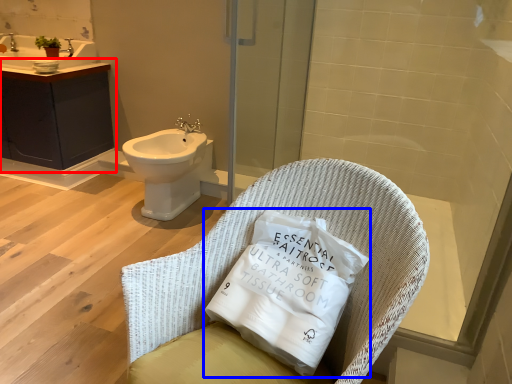
Question: Which of the following is the closest to the observer, bathroom cabinet (highlighted by a red box) or pillow (highlighted by a blue box)?

Choices:
 (A) bathroom cabinet
 (B) pillow

Answer: (B)